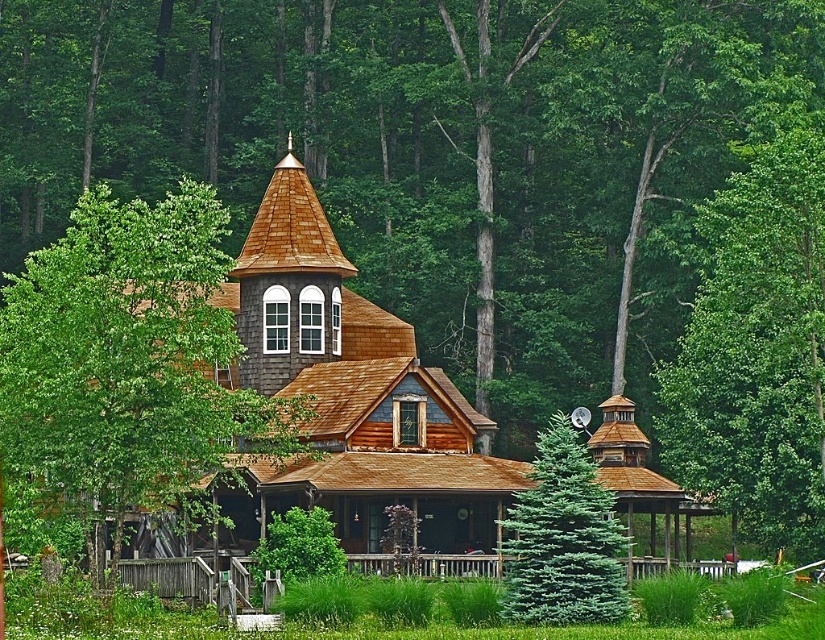
Question: Which object appears farthest from the camera in this image?

Choices:
 (A) green leafy tree at upper center
 (B) green fir at center
 (C) green leafy tree at center

Answer: (A)

Question: Is the position of green leafy tree at upper center more distant than that of green fir at center?

Choices:
 (A) yes
 (B) no

Answer: (A)

Question: Which point is farther from the camera taking this photo?

Choices:
 (A) (729, 259)
 (B) (130, 376)
 (C) (597, 518)

Answer: (A)

Question: Is green leafy tree at upper center positioned before green fir at center?

Choices:
 (A) yes
 (B) no

Answer: (B)

Question: Which point is closer to the camera?

Choices:
 (A) (145, 268)
 (B) (776, 410)
 (C) (536, 582)

Answer: (A)

Question: Can you confirm if green leafy tree at upper center is smaller than green fir at center?

Choices:
 (A) yes
 (B) no

Answer: (B)